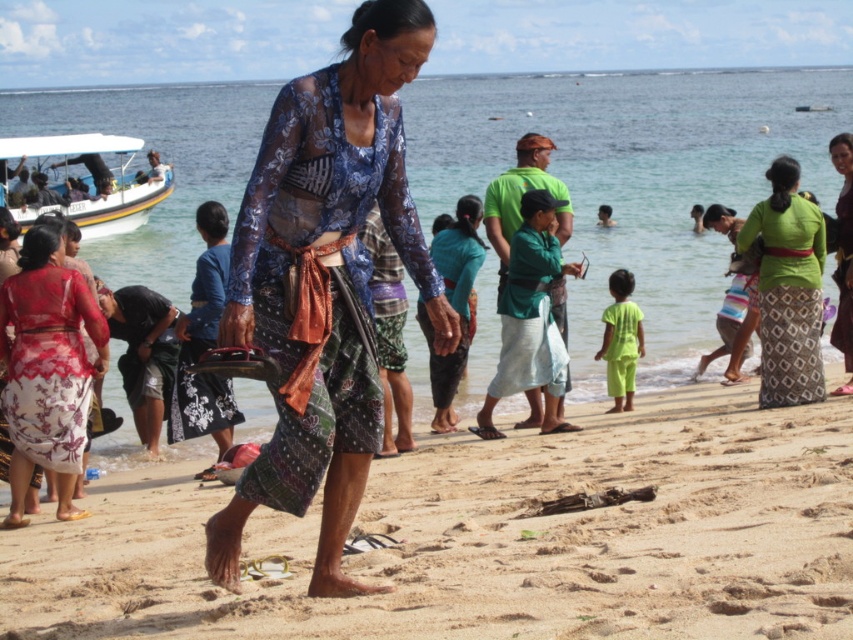
Question: Is clear blue water at center above green woven skirt at right?

Choices:
 (A) yes
 (B) no

Answer: (A)

Question: Which object is farther from the camera taking this photo?

Choices:
 (A) green woven skirt at center
 (B) neon green fabric at lower center
 (C) white plastic boat at upper left
 (D) clear blue water at center

Answer: (C)

Question: Is sandy beach at center behind green woven skirt at center?

Choices:
 (A) no
 (B) yes

Answer: (A)

Question: Estimate the real-world distances between objects in this image. Which object is farther from the white plastic boat at upper left?

Choices:
 (A) translucent floral dress at lower left
 (B) clear blue water at center
 (C) neon green fabric at lower center
 (D) matte green skirt at center

Answer: (D)

Question: Which object appears closest to the camera in this image?

Choices:
 (A) clear blue water at center
 (B) batik fabric dress at center

Answer: (B)

Question: Observing the image, what is the correct spatial positioning of green woven skirt at right in reference to matte green skirt at center?

Choices:
 (A) right
 (B) left

Answer: (B)